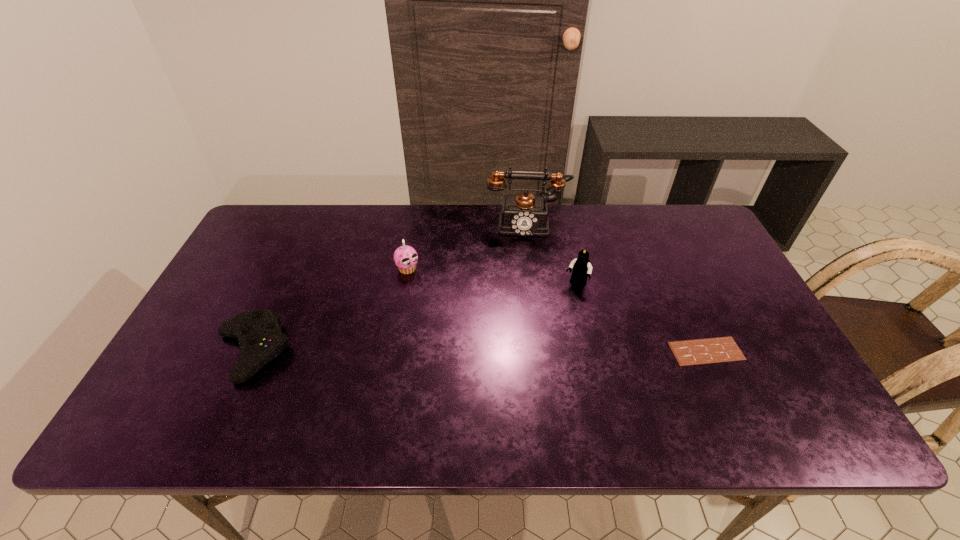
At what (x,y) coordinates should I click in order to perform the action: click on free spot on the desktop that is between the fourth tallest object and the rightmost object and is positioned on the face of the second object from left to right. Please return your answer as a coordinate pair (x, y). Looking at the image, I should click on (490, 351).

At what (x,y) coordinates should I click in order to perform the action: click on free space on the desktop that is between the second shortest object and the chocolate bar and is positioned on the front-facing side of the Lego. Please return your answer as a coordinate pair (x, y). Looking at the image, I should click on (540, 351).

This screenshot has height=540, width=960. Identify the location of free space on the desktop that is between the fourth tallest object and the rightmost object and is positioned on the front of the tallest object at the rotary dial. (527, 351).